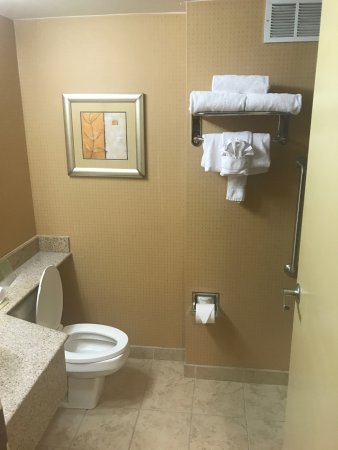
This screenshot has width=338, height=450. Find the location of `door`. door is located at coordinates (319, 335).